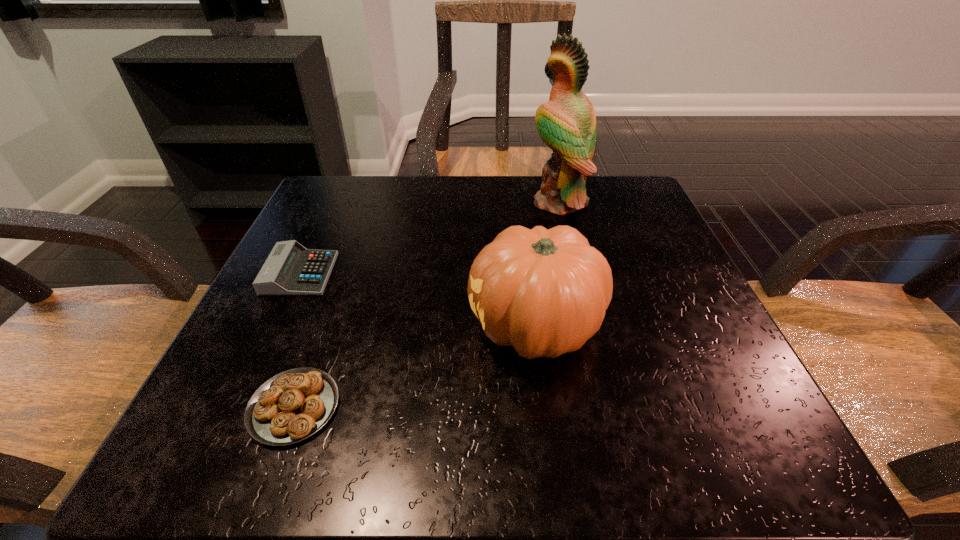
Identify the location of object that stands as the closest to the pastry. (290, 269).

At what (x,y) coordinates should I click in order to perform the action: click on the second closest object to the pumpkin. Please return your answer as a coordinate pair (x, y). The image size is (960, 540). Looking at the image, I should click on (567, 123).